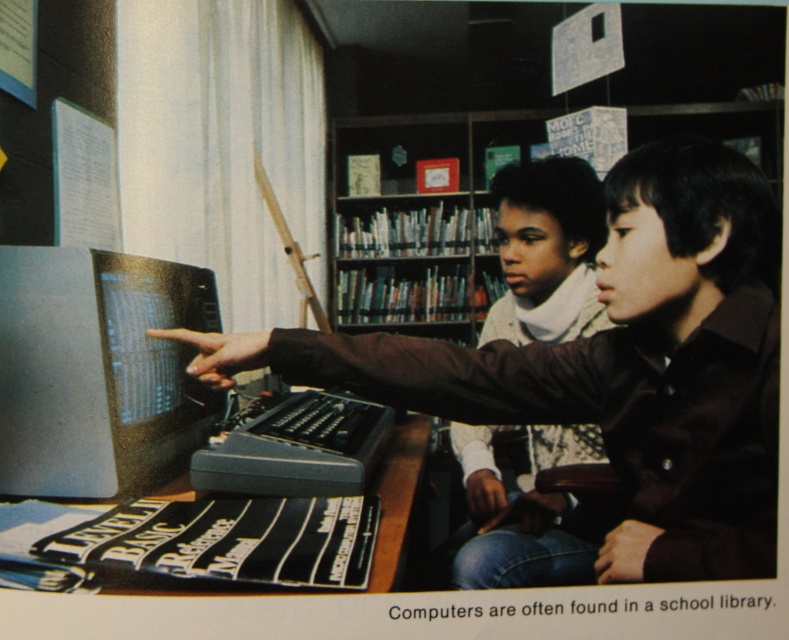
You are a student trying to place a new textbook that is 18 inches wide onto the desk. The desk has the matte black monitor at center and the white knit sweater at center. Which object on the desk would you need to move to make space for the textbook, considering their widths?

The matte black monitor at center has a lesser width compared to white knit sweater at center. Since the textbook is 18 inches wide, you would need to move the white knit sweater at center because it takes up more space on the desk.

You are a student trying to reach the matte black monitor at center to adjust the brightness. You are wearing a white knit sweater at center. Can you move your sweater to access the monitor?

The matte black monitor at center is above the white knit sweater at center, so you can move the sweater to access the monitor.

You are a student trying to access the computer at center in the library scene. There is a point marked at coordinates (x=610, y=381). Can you confirm if this point corresponds to the location of the matte black computer at center?

The point (x=610, y=381) indicates the matte black computer at center, so yes, this point corresponds to its location.